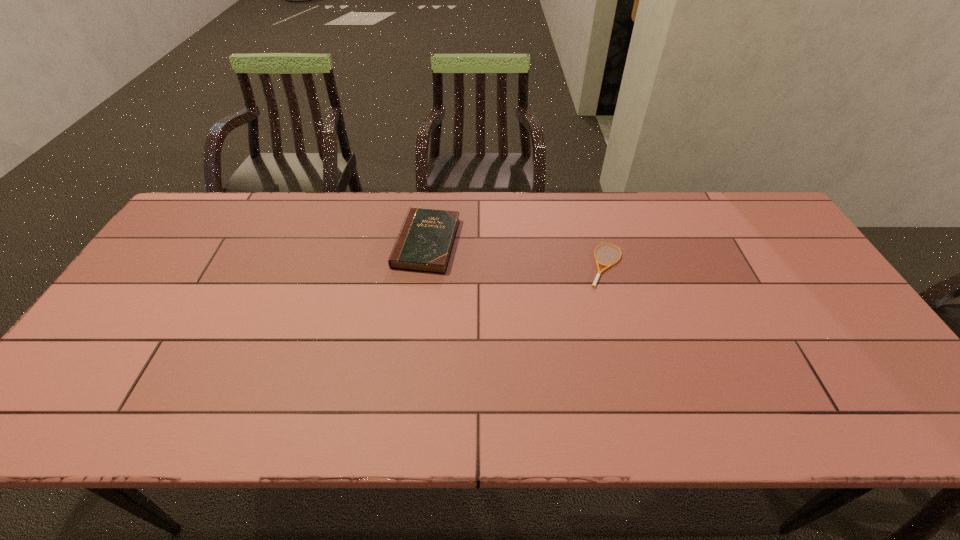
This screenshot has height=540, width=960. Find the location of `the left object`. the left object is located at coordinates (424, 244).

I want to click on the taller object, so click(x=424, y=244).

The width and height of the screenshot is (960, 540). I want to click on tennis racket, so click(x=607, y=266).

Image resolution: width=960 pixels, height=540 pixels. What are the coordinates of `the right object` in the screenshot? It's located at (607, 266).

The width and height of the screenshot is (960, 540). In order to click on free region located 0.110m on the left of the left object in this screenshot , I will do `click(358, 244)`.

This screenshot has height=540, width=960. I want to click on blank area located on the left of the shorter object, so click(x=540, y=265).

Identify the location of object that is at the far edge. (424, 244).

Find the location of a particular element. free space at the far edge of the desktop is located at coordinates (263, 226).

The image size is (960, 540). I want to click on vacant space at the near edge, so click(x=488, y=428).

This screenshot has width=960, height=540. In the image, there is a desktop. Find the location of `free space at the left edge`. free space at the left edge is located at coordinates (174, 252).